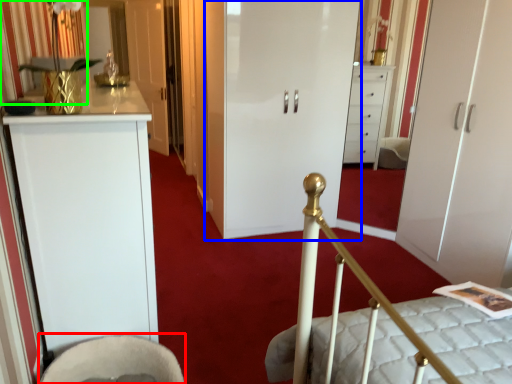
Question: Considering the real-world distances, which object is closest to rocking chair (highlighted by a red box)? door (highlighted by a blue box) or curtain (highlighted by a green box).

Choices:
 (A) door
 (B) curtain

Answer: (B)